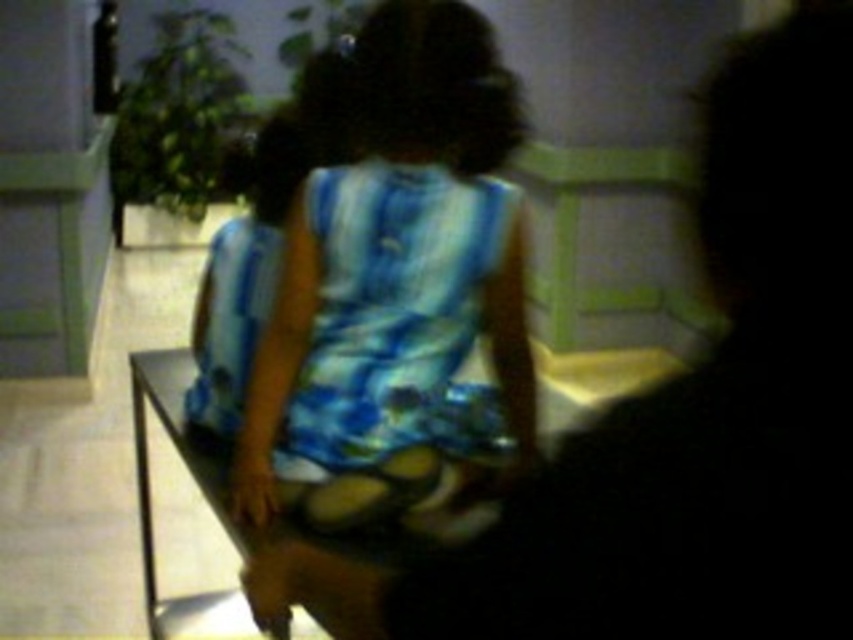
Can you confirm if blue printed dress at center is positioned below blue tie-dye fabric dress at center?

Yes.

Can you confirm if blue printed dress at center is thinner than blue tie-dye fabric dress at center?

No, blue printed dress at center is not thinner than blue tie-dye fabric dress at center.

Between point (793, 554) and point (335, 186), which one is positioned behind?

The point (335, 186) is behind.

This screenshot has height=640, width=853. Find the location of `blue printed dress at center`. blue printed dress at center is located at coordinates (679, 420).

Which is below, blue tie-dye dress at center or blue tie-dye fabric dress at center?

Positioned lower is blue tie-dye fabric dress at center.

Does point (363, 32) come farther from viewer compared to point (402, 259)?

Yes, point (363, 32) is farther from viewer.

At what (x,y) coordinates should I click in order to perform the action: click on blue tie-dye dress at center. Please return your answer as a coordinate pair (x, y). This screenshot has width=853, height=640. Looking at the image, I should click on (397, 289).

What are the coordinates of `blue tie-dye dress at center` in the screenshot? It's located at (397, 289).

Does blue printed dress at center appear under blue tie-dye dress at center?

Indeed, blue printed dress at center is positioned under blue tie-dye dress at center.

Who is more distant from viewer, (711, 378) or (409, 147)?

The point (409, 147) is behind.

The height and width of the screenshot is (640, 853). What are the coordinates of `blue printed dress at center` in the screenshot? It's located at point(679,420).